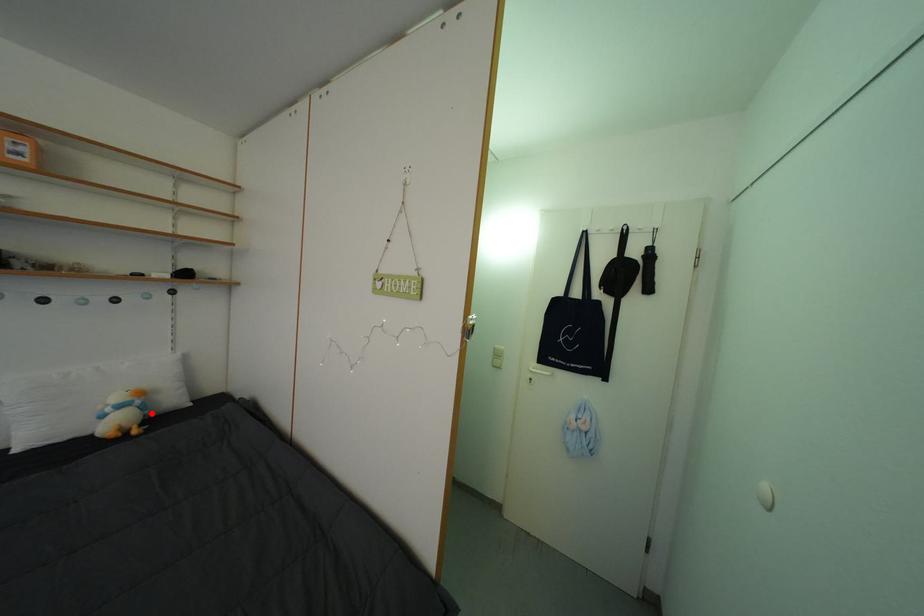
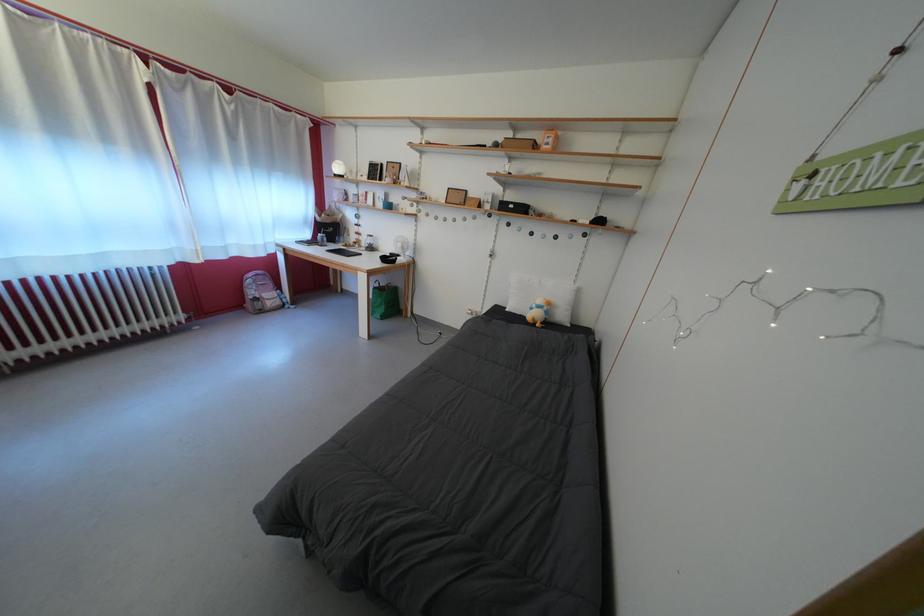
Question: I am providing you with two images of the same scene from different viewpoints. A red point is shown in image1. For the corresponding object point in image2, is it positioned nearer or farther from the camera?

Choices:
 (A) Nearer
 (B) Farther

Answer: (A)